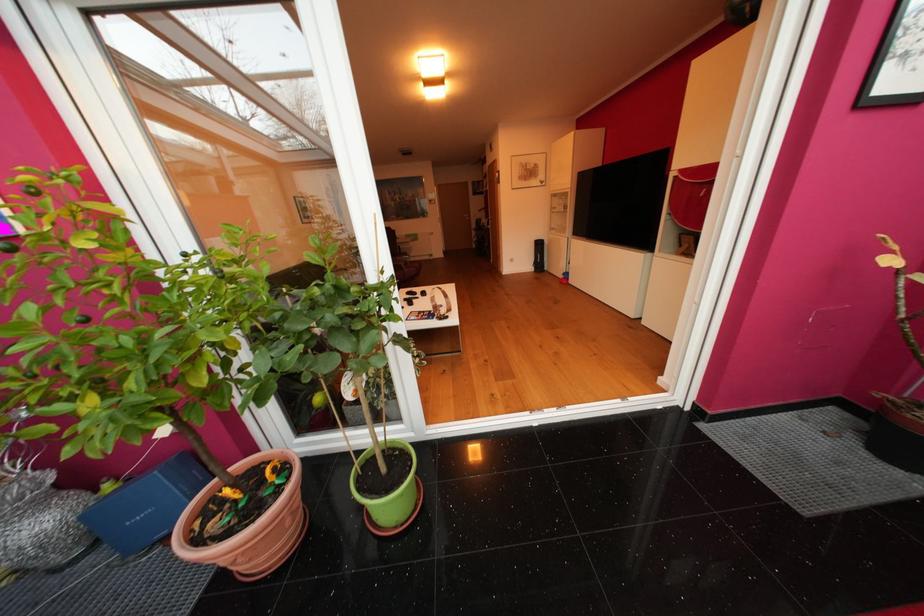
Find where to resting arm the dark chair armrest. Please return your answer as a coordinate pair (x, y).

(406, 272)